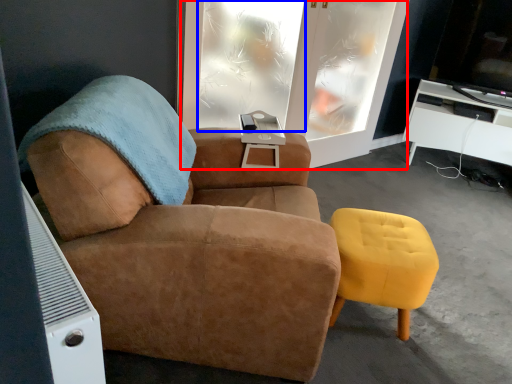
Question: Which object appears closest to the camera in this image, screen door (highlighted by a red box) or window (highlighted by a blue box)?

Choices:
 (A) screen door
 (B) window

Answer: (B)